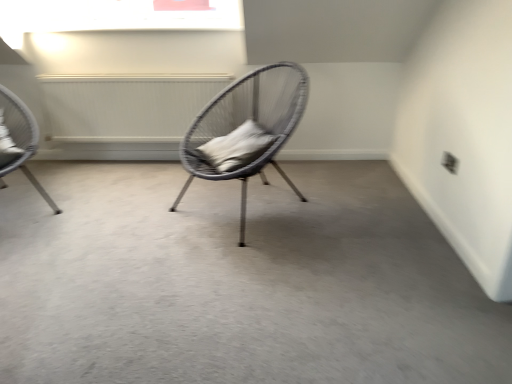
Question: Is smooth gray carpet at center to the left of matte wicker chair at left, the 2th chair when ordered from right to left, from the viewer's perspective?

Choices:
 (A) no
 (B) yes

Answer: (A)

Question: Can you see smooth gray carpet at center touching matte wicker chair at left, the 2th chair when ordered from right to left?

Choices:
 (A) no
 (B) yes

Answer: (A)

Question: Can you confirm if smooth gray carpet at center is positioned to the right of matte wicker chair at left, the 2th chair when ordered from right to left?

Choices:
 (A) no
 (B) yes

Answer: (B)

Question: Considering the relative sizes of smooth gray carpet at center and matte wicker chair at left, which is counted as the 1th chair, starting from the left, in the image provided, is smooth gray carpet at center taller than matte wicker chair at left, which is counted as the 1th chair, starting from the left,?

Choices:
 (A) yes
 (B) no

Answer: (B)

Question: Is smooth gray carpet at center surrounding matte wicker chair at left, which is counted as the 1th chair, starting from the left?

Choices:
 (A) yes
 (B) no

Answer: (B)

Question: Is smooth gray carpet at center facing towards matte wicker chair at left, which is counted as the 1th chair, starting from the left?

Choices:
 (A) yes
 (B) no

Answer: (B)

Question: Is gray fabric pillow at center located within matte wicker chair at left, the 2th chair when ordered from right to left?

Choices:
 (A) no
 (B) yes

Answer: (A)

Question: Is matte wicker chair at left, the 2th chair when ordered from right to left, not inside gray fabric pillow at center?

Choices:
 (A) yes
 (B) no

Answer: (A)

Question: From the image's perspective, is matte wicker chair at left, which is counted as the 1th chair, starting from the left, below gray fabric pillow at center?

Choices:
 (A) yes
 (B) no

Answer: (B)

Question: Considering the relative sizes of matte wicker chair at left, which is counted as the 1th chair, starting from the left, and gray fabric pillow at center in the image provided, is matte wicker chair at left, which is counted as the 1th chair, starting from the left, smaller than gray fabric pillow at center?

Choices:
 (A) no
 (B) yes

Answer: (A)

Question: Is matte wicker chair at left, the 2th chair when ordered from right to left, looking in the opposite direction of gray fabric pillow at center?

Choices:
 (A) no
 (B) yes

Answer: (A)

Question: Can you confirm if matte wicker chair at left, which is counted as the 1th chair, starting from the left, is thinner than gray fabric pillow at center?

Choices:
 (A) yes
 (B) no

Answer: (B)

Question: Considering the relative sizes of woven grey chair at center, which appears as the 1th chair when viewed from the right, and smooth gray carpet at center in the image provided, is woven grey chair at center, which appears as the 1th chair when viewed from the right, thinner than smooth gray carpet at center?

Choices:
 (A) no
 (B) yes

Answer: (B)